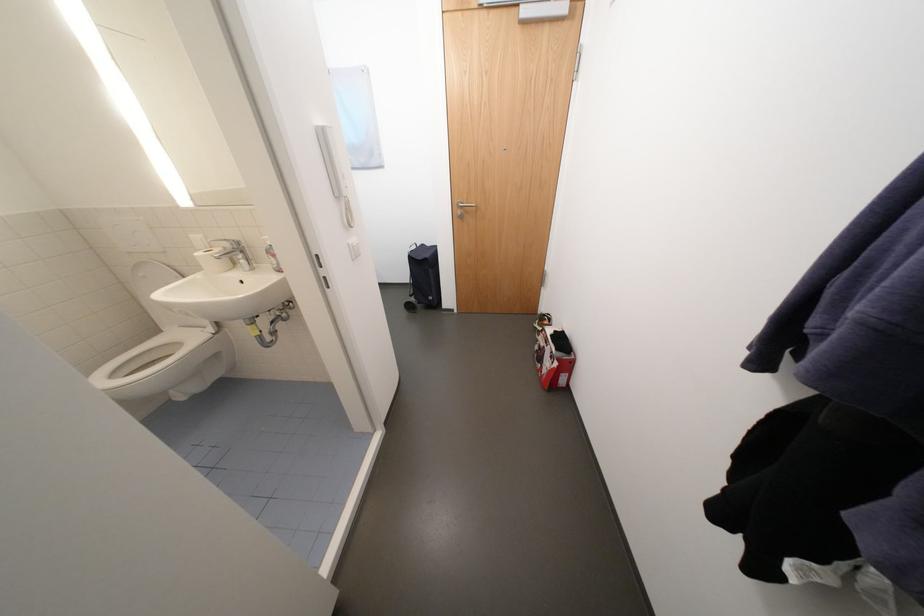
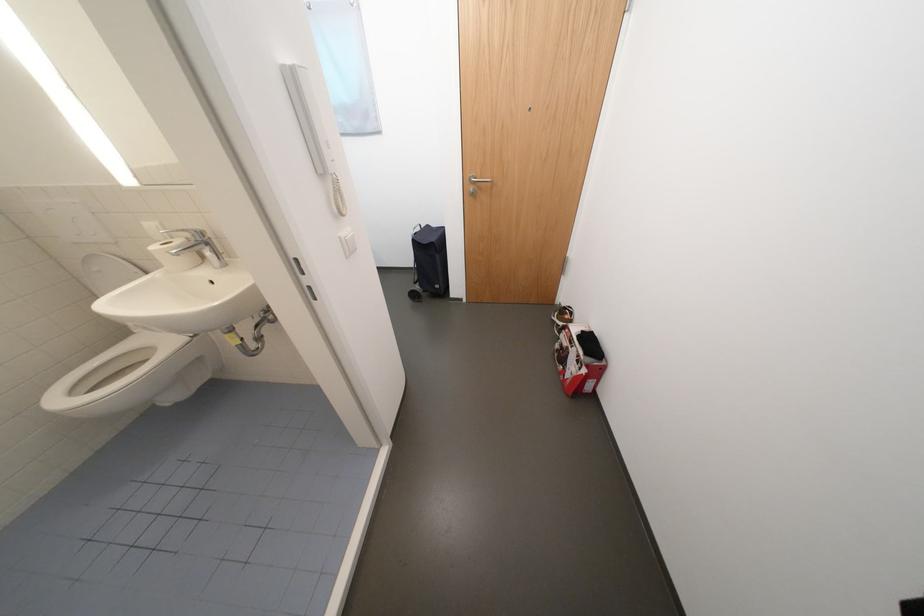
Where in the second image is the point corresponding to [172,331] from the first image?

(142, 333)